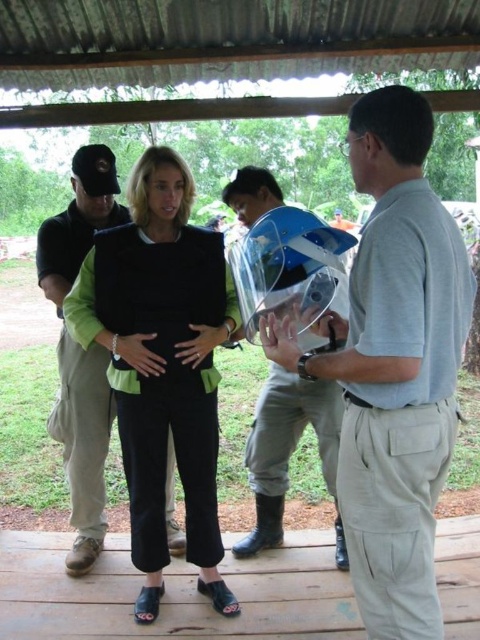
You are a safety inspector checking the equipment of workers at a construction site. You notice a worker wearing a black matte vest at center and a clear plastic helmet at center. According to safety protocols, which piece of equipment should be visible to ensure proper protection? Please explain your reasoning.

The black matte vest at center is in front of the clear plastic helmet at center. For proper protection, the clear plastic helmet at center should be visible at all times to ensure it is properly worn and providing head protection. The vest being in front may obstruct visibility of the helmet, indicating it might not be positioned correctly.

Where is the light gray cotton shirt at right located in the image?

The light gray cotton shirt at right is located at point (394, 365) in the image.